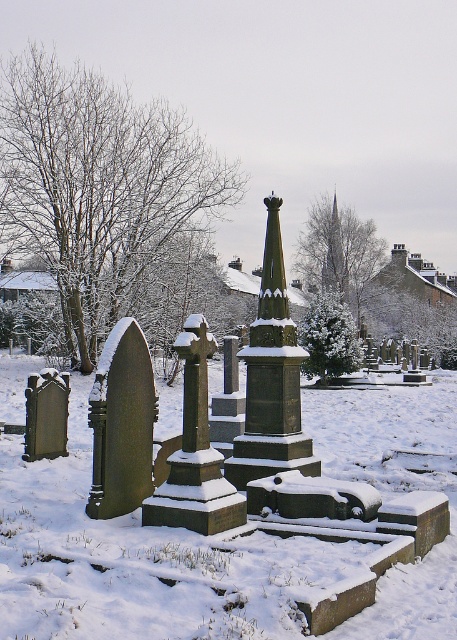
Question: Considering the relative positions of white frosty snow at center and smooth gray spire at upper center in the image provided, where is white frosty snow at center located with respect to smooth gray spire at upper center?

Choices:
 (A) below
 (B) above

Answer: (A)

Question: Among these objects, which one is farthest from the camera?

Choices:
 (A) white frosty snow at center
 (B) smooth gray spire at upper center

Answer: (B)

Question: Does white frosty snow at center have a greater width compared to smooth gray spire at upper center?

Choices:
 (A) no
 (B) yes

Answer: (B)

Question: Observing the image, what is the correct spatial positioning of white frosty snow at center in reference to smooth gray spire at upper center?

Choices:
 (A) above
 (B) below

Answer: (B)